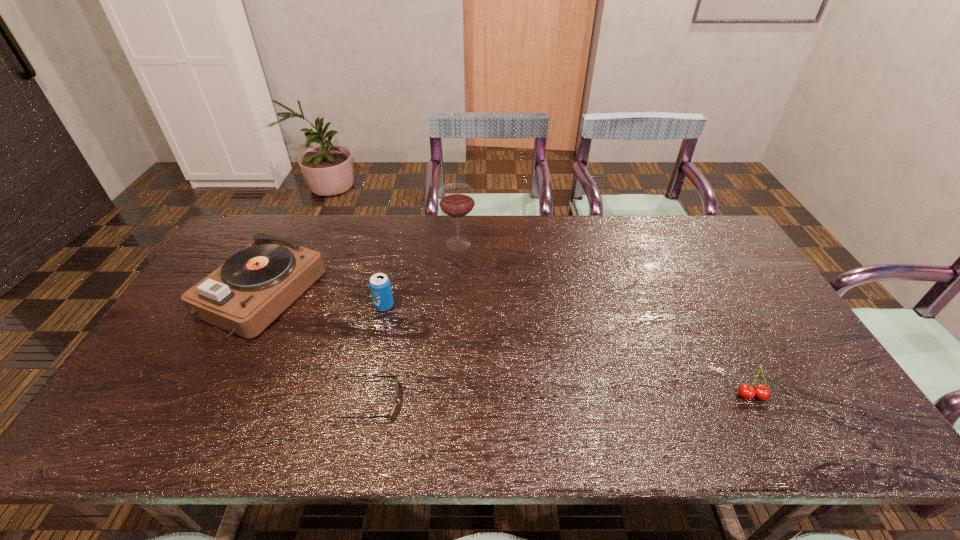
What are the coordinates of `vacant space at the far right corner of the desktop` in the screenshot? It's located at (678, 217).

At what (x,y) coordinates should I click in order to perform the action: click on unoccupied area between the record player and the sunglasses. Please return your answer as a coordinate pair (x, y). The width and height of the screenshot is (960, 540). Looking at the image, I should click on (318, 348).

This screenshot has width=960, height=540. I want to click on vacant region between the soda can and the tallest object, so click(421, 275).

Identify the location of free space between the rightmost object and the wineglass. The height and width of the screenshot is (540, 960). (605, 320).

Identify the location of free area in between the wineglass and the rightmost object. The image size is (960, 540). (605, 320).

In order to click on empty space between the rightmost object and the leftmost object in this screenshot , I will do `click(507, 345)`.

Where is `free space between the sunglasses and the cherry`? The image size is (960, 540). free space between the sunglasses and the cherry is located at coordinates (563, 399).

You are a GUI agent. You are given a task and a screenshot of the screen. Output one action in this format:
    pyautogui.click(x=<x>, y=<y>)
    Task: Click on the free space between the leftmost object and the sunglasses
    This screenshot has height=540, width=960.
    Given the screenshot: What is the action you would take?
    pyautogui.click(x=318, y=348)

Locate an element on the screen. free space between the shortest object and the tallest object is located at coordinates (416, 322).

Locate an element on the screen. Image resolution: width=960 pixels, height=540 pixels. free space between the leftmost object and the second object from right to left is located at coordinates (360, 269).